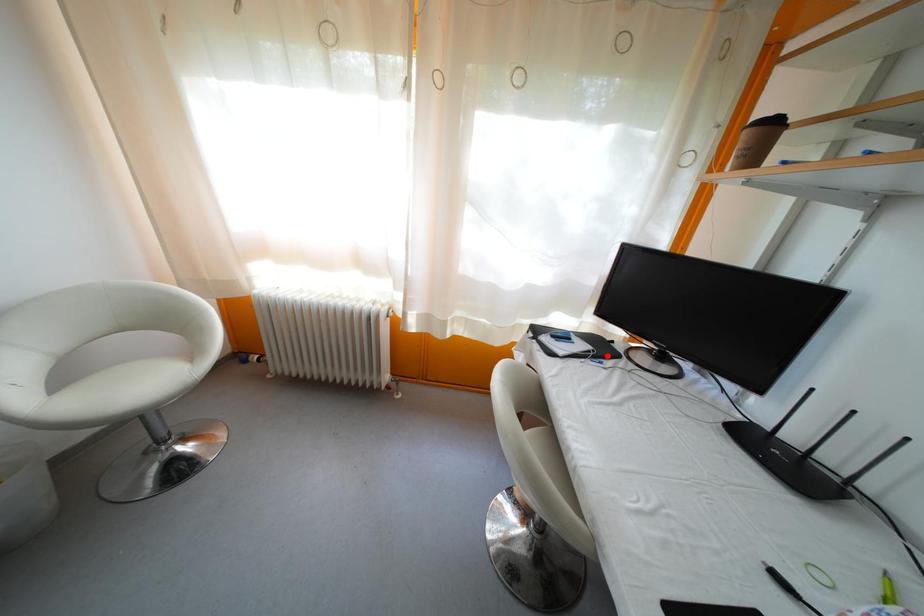
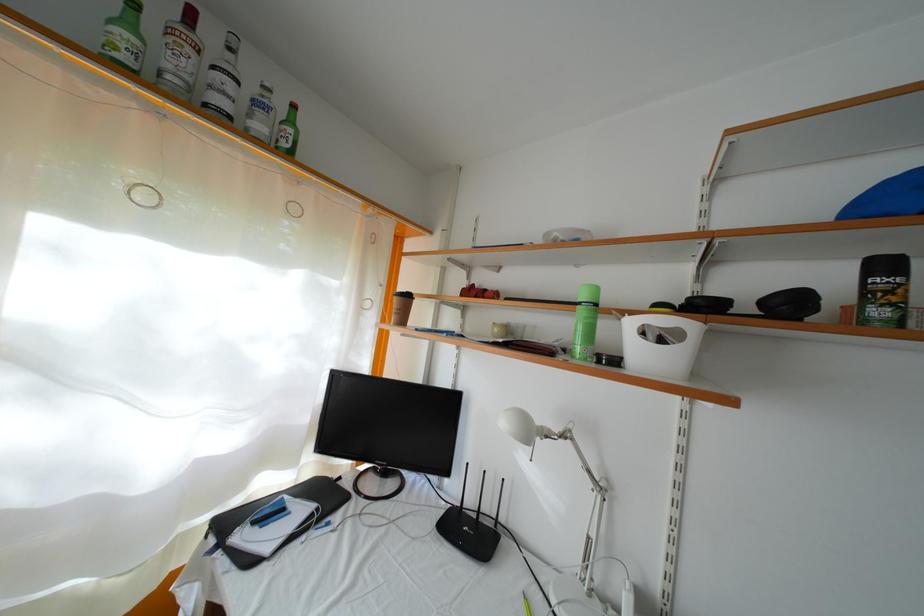
Find the pixel in the second image that matches the highlighted location in the first image.

(334, 506)